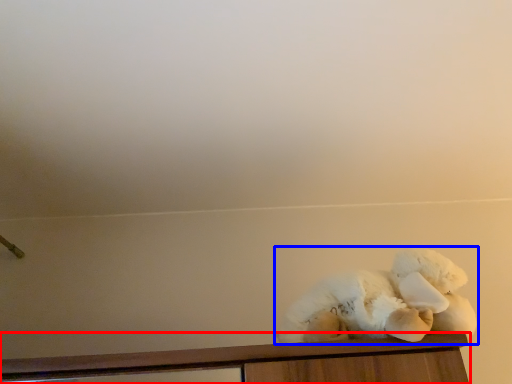
Question: Which object appears farthest to the camera in this image, furniture (highlighted by a red box) or teddy bear (highlighted by a blue box)?

Choices:
 (A) furniture
 (B) teddy bear

Answer: (B)